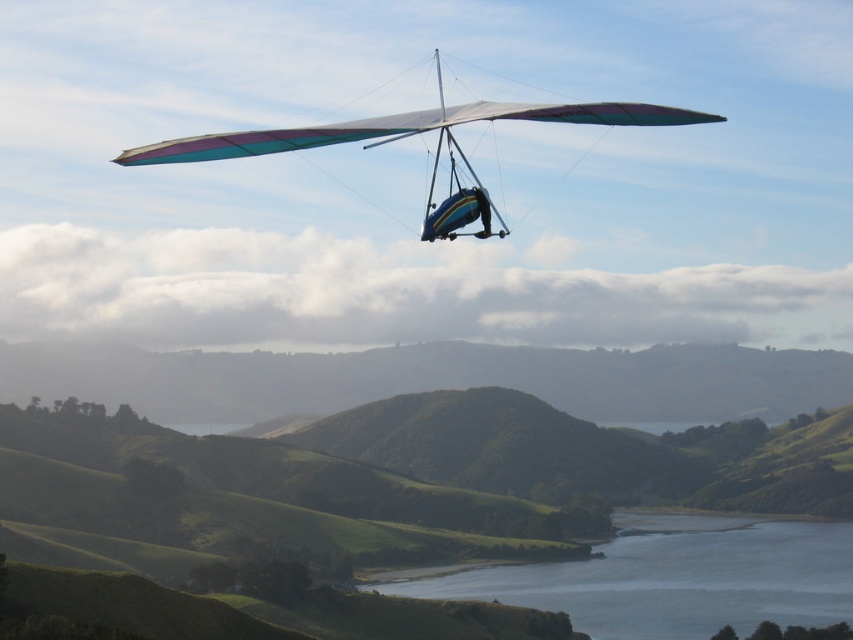
Question: Where is smooth blue water at lower center located in relation to rainbow fabric glider at upper center in the image?

Choices:
 (A) above
 (B) below

Answer: (B)

Question: Which of the following is the farthest from the observer?

Choices:
 (A) (164, 148)
 (B) (808, 608)

Answer: (B)

Question: Among these objects, which one is farthest from the camera?

Choices:
 (A) smooth blue water at lower center
 (B) rainbow fabric glider at upper center

Answer: (A)

Question: Is smooth blue water at lower center closer to the viewer compared to rainbow fabric glider at upper center?

Choices:
 (A) yes
 (B) no

Answer: (B)

Question: Is smooth blue water at lower center wider than rainbow fabric glider at upper center?

Choices:
 (A) no
 (B) yes

Answer: (B)

Question: Which point is farther to the camera?

Choices:
 (A) (659, 579)
 (B) (236, 148)

Answer: (A)